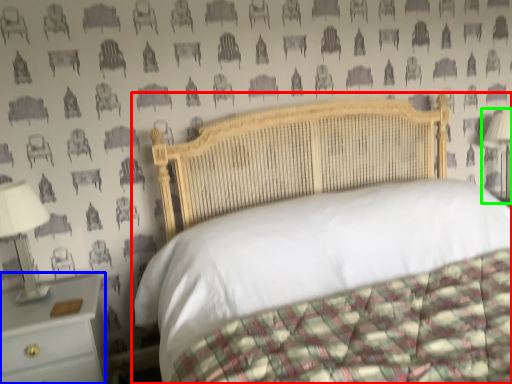
Question: Which object is positioned farthest from bed (highlighted by a red box)? Select from nightstand (highlighted by a blue box) and bedside lamp (highlighted by a green box).

Choices:
 (A) nightstand
 (B) bedside lamp

Answer: (B)